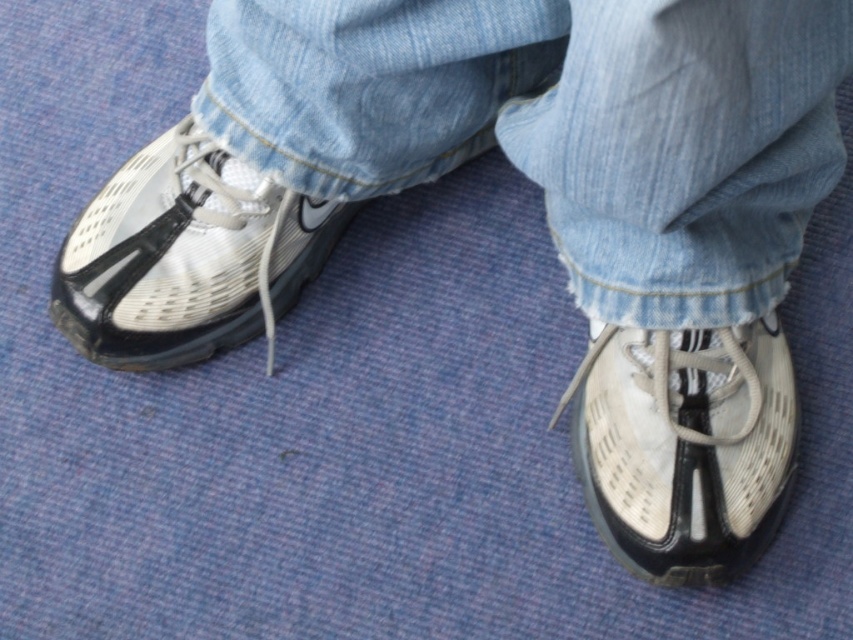
You are a delivery robot that needs to pass between the white mesh shoe at lower right and the shiny silver shoe at left. Your body is 22 inches wide. Can you fit through the space between them?

The distance between the white mesh shoe at lower right and the shiny silver shoe at left is 22.68 inches, so the robot can fit through since its width of 22 inches is less than the available space.

You are a tailor measuring a customer for new jeans. You observe the denim at lower left and the white mesh shoe at lower right in the image. Which item is bigger in size?

The denim at lower left is larger in size than the white mesh shoe at lower right.